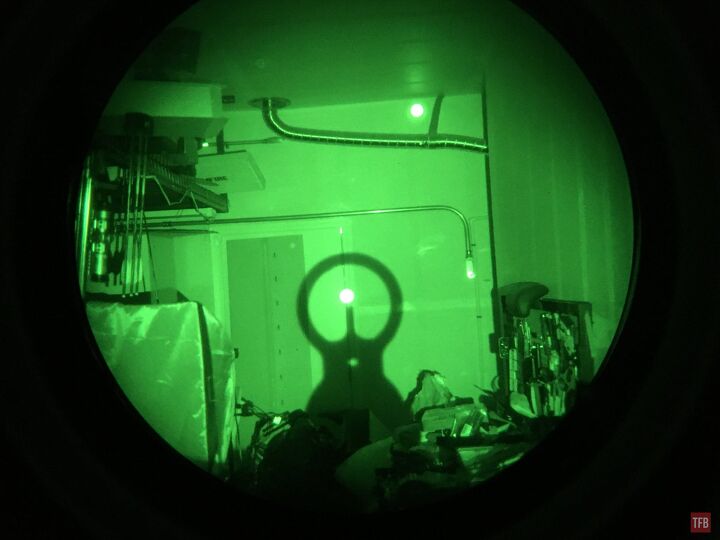
The width and height of the screenshot is (720, 540). Identify the location of ceiling. 366,87.